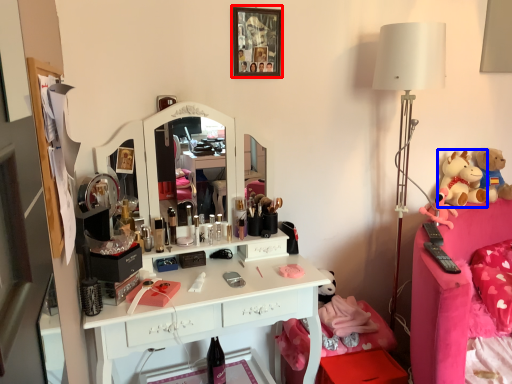
Question: Among these objects, which one is farthest to the camera, picture frame (highlighted by a red box) or toy (highlighted by a blue box)?

Choices:
 (A) picture frame
 (B) toy

Answer: (B)